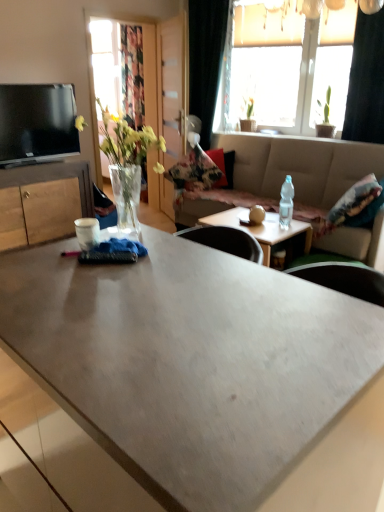
Measure the distance between point (263, 54) and camera.

The distance of point (263, 54) from camera is 4.55 meters.

Measure the distance between point (46,176) and camera.

Point (46,176) and camera are 3.54 meters apart from each other.

You are a GUI agent. You are given a task and a screenshot of the screen. Output one action in this format:
    pyautogui.click(x=<x>, y=<y>)
    Task: Click on the translucent glass window at upper center
    The height and width of the screenshot is (512, 384).
    Given the screenshot: What is the action you would take?
    pyautogui.click(x=261, y=67)

Is black velvet curtain at upper right, which is counted as the second curtain, starting from the right, not close to clear glass vase at left?

Yes.

Is black velvet curtain at upper right, which is the 2th curtain in front-to-back order, to the right of clear glass vase at left from the viewer's perspective?

Yes.

Considering the relative sizes of black matte curtain at upper right, which is the second curtain from left to right, and translucent glass window at upper center in the image provided, is black matte curtain at upper right, which is the second curtain from left to right, smaller than translucent glass window at upper center?

Indeed, black matte curtain at upper right, which is the second curtain from left to right, has a smaller size compared to translucent glass window at upper center.

Is translucent glass window at upper center completely or partially inside black matte curtain at upper right, which ranks as the 1th curtain in right-to-left order?

No, translucent glass window at upper center is not inside black matte curtain at upper right, which ranks as the 1th curtain in right-to-left order.

Is black matte curtain at upper right, which ranks as the 1th curtain in right-to-left order, looking in the opposite direction of translucent glass window at upper center?

No.

From a real-world perspective, is beige fabric studio couch at center located higher than translucent glass window at upper center?

No, from a real-world perspective, beige fabric studio couch at center is not on top of translucent glass window at upper center.

Considering the positions of point (369, 241) and point (289, 33), is point (369, 241) closer or farther from the camera than point (289, 33)?

Clearly, point (369, 241) is closer to the camera than point (289, 33).

Is beige fabric studio couch at center next to translucent glass window at upper center?

beige fabric studio couch at center is not next to translucent glass window at upper center, and they're not touching.

Is transparent wood door at center inside the boundaries of black matte curtain at upper right, which ranks as the 1th curtain in right-to-left order, or outside?

transparent wood door at center is not enclosed by black matte curtain at upper right, which ranks as the 1th curtain in right-to-left order.

Does point (157, 42) come farther from viewer compared to point (371, 34)?

Yes, it is.

From a real-world perspective, is transparent wood door at center on black matte curtain at upper right, which is counted as the first curtain, starting from the front?

No, from a real-world perspective, transparent wood door at center is not on top of black matte curtain at upper right, which is counted as the first curtain, starting from the front.

Does transparent wood door at center lie behind black matte curtain at upper right, which is the second curtain from left to right?

Yes, it is behind black matte curtain at upper right, which is the second curtain from left to right.

Looking at this image, how different are the orientations of black velvet curtain at upper right, the 1th curtain in the left-to-right sequence, and matte concrete coffee table at center, which is counted as the second coffee table, starting from the back, in degrees?

There is a 178-degree angle between the facing directions of black velvet curtain at upper right, the 1th curtain in the left-to-right sequence, and matte concrete coffee table at center, which is counted as the second coffee table, starting from the back.

Does point (201, 50) come closer to viewer compared to point (223, 307)?

No, it is not.

Considering the relative positions of black velvet curtain at upper right, which is the 2th curtain in front-to-back order, and matte concrete coffee table at center, acting as the 1th coffee table starting from the front, in the image provided, is black velvet curtain at upper right, which is the 2th curtain in front-to-back order, to the left of matte concrete coffee table at center, acting as the 1th coffee table starting from the front, from the viewer's perspective?

No.

From a real-world perspective, is black velvet curtain at upper right, which is counted as the second curtain, starting from the right, on transparent wood door at center?

Indeed, from a real-world perspective, black velvet curtain at upper right, which is counted as the second curtain, starting from the right, stands above transparent wood door at center.

Looking at their sizes, would you say black velvet curtain at upper right, the 1th curtain in the left-to-right sequence, is wider or thinner than transparent wood door at center?

In the image, black velvet curtain at upper right, the 1th curtain in the left-to-right sequence, appears to be wider than transparent wood door at center.

Does black velvet curtain at upper right, placed as the 1th curtain when sorted from back to front, have a larger size compared to transparent wood door at center?

Correct, black velvet curtain at upper right, placed as the 1th curtain when sorted from back to front, is larger in size than transparent wood door at center.

Does black velvet curtain at upper right, placed as the 1th curtain when sorted from back to front, come in front of transparent wood door at center?

That is False.

Considering the relative positions of beige fabric studio couch at center and black matte curtain at upper right, which ranks as the 1th curtain in right-to-left order, in the image provided, is beige fabric studio couch at center behind black matte curtain at upper right, which ranks as the 1th curtain in right-to-left order,?

No, it is in front of black matte curtain at upper right, which ranks as the 1th curtain in right-to-left order.

Based on the photo, is the surface of beige fabric studio couch at center in direct contact with black matte curtain at upper right, which is counted as the first curtain, starting from the front?

No, beige fabric studio couch at center is not in contact with black matte curtain at upper right, which is counted as the first curtain, starting from the front.

Considering the relative sizes of beige fabric studio couch at center and black matte curtain at upper right, which ranks as the 1th curtain in right-to-left order, in the image provided, is beige fabric studio couch at center taller than black matte curtain at upper right, which ranks as the 1th curtain in right-to-left order,?

No.

From the image's perspective, between beige fabric studio couch at center and black matte curtain at upper right, which is the second curtain from left to right, who is located below?

beige fabric studio couch at center appears lower in the image.

In the image, there is a black velvet curtain at upper right, which is counted as the second curtain, starting from the right. Find the location of `floral arrangement below it (from a real-world perspective)`. floral arrangement below it (from a real-world perspective) is located at coordinates (126, 162).

At what (x,y) coordinates should I click in order to perform the action: click on window above the black matte curtain at upper right, the second curtain viewed from the back (from the image's perspective). Please return your answer as a coordinate pair (x, y). Looking at the image, I should click on (261, 67).

Estimate the real-world distances between objects in this image. Which object is further from matte concrete coffee table at center, which is counted as the second coffee table, starting from the back, matte wooden coffee table at center, the first coffee table positioned from the back, or wooden cabinet at left?

Among the two, wooden cabinet at left is located further to matte concrete coffee table at center, which is counted as the second coffee table, starting from the back.

Which object lies nearer to the anchor point black velvet curtain at upper right, which is the 2th curtain in front-to-back order, matte black tv at upper left or clear glass vase at left?

Based on the image, matte black tv at upper left appears to be nearer to black velvet curtain at upper right, which is the 2th curtain in front-to-back order.

From the image, which object appears to be nearer to clear glass vase at left, matte wooden coffee table at center, the first coffee table positioned from the back, or wooden cabinet at left?

The object closer to clear glass vase at left is matte wooden coffee table at center, the first coffee table positioned from the back.

From the image, which object appears to be nearer to matte black tv at upper left, matte wooden coffee table at center, the first coffee table positioned from the back, or beige fabric studio couch at center?

matte wooden coffee table at center, the first coffee table positioned from the back, is positioned closer to the anchor matte black tv at upper left.

When comparing their distances from black velvet curtain at upper right, the 1th curtain in the left-to-right sequence, does transparent wood door at center or beige fabric studio couch at center seem closer?

transparent wood door at center lies closer to black velvet curtain at upper right, the 1th curtain in the left-to-right sequence, than the other object.

Looking at the image, which one is located closer to translucent glass window at upper center, matte concrete coffee table at center, which is counted as the second coffee table, starting from the back, or beige fabric studio couch at center?

Based on the image, beige fabric studio couch at center appears to be nearer to translucent glass window at upper center.

Looking at the image, which one is located closer to translucent glass window at upper center, beige fabric studio couch at center or transparent wood door at center?

Based on the image, beige fabric studio couch at center appears to be nearer to translucent glass window at upper center.

Which object lies nearer to the anchor point beige fabric studio couch at center, matte black tv at upper left or wooden cabinet at left?

wooden cabinet at left is positioned closer to the anchor beige fabric studio couch at center.

Where is `glass door between matte black tv at upper left and black velvet curtain at upper right, which is the 2th curtain in front-to-back order`? The height and width of the screenshot is (512, 384). glass door between matte black tv at upper left and black velvet curtain at upper right, which is the 2th curtain in front-to-back order is located at coordinates (170, 89).

Where is `glass door between translucent glass window at upper center and matte wooden coffee table at center, the first coffee table positioned from the back, from top to bottom`? This screenshot has width=384, height=512. glass door between translucent glass window at upper center and matte wooden coffee table at center, the first coffee table positioned from the back, from top to bottom is located at coordinates (170, 89).

Where is `television positioned between clear glass vase at left and wooden cabinet at left from near to far`? This screenshot has height=512, width=384. television positioned between clear glass vase at left and wooden cabinet at left from near to far is located at coordinates (37, 123).

Locate an element on the screen. The image size is (384, 512). window between black velvet curtain at upper right, which is counted as the second curtain, starting from the right, and beige fabric studio couch at center from top to bottom is located at coordinates pos(261,67).